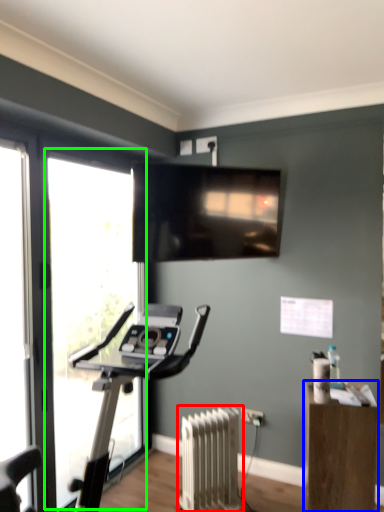
Question: Based on their relative distances, which object is farther from radiator (highlighted by a red box)? Choose from furniture (highlighted by a blue box) and window (highlighted by a green box).

Choices:
 (A) furniture
 (B) window

Answer: (B)